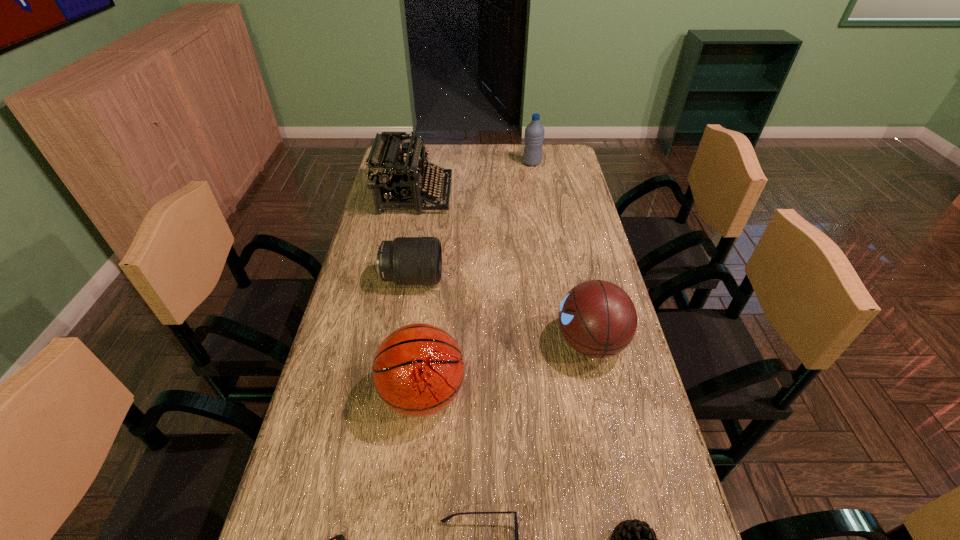
You are a GUI agent. You are given a task and a screenshot of the screen. Output one action in this format:
    pyautogui.click(x=<x>, y=<y>)
    Task: Click on the typewriter
    
    Given the screenshot: What is the action you would take?
    pyautogui.click(x=394, y=180)

You are a GUI agent. You are given a task and a screenshot of the screen. Output one action in this format:
    pyautogui.click(x=<x>, y=<y>)
    Task: Click on the farthest object
    This screenshot has height=540, width=960.
    Given the screenshot: What is the action you would take?
    pyautogui.click(x=534, y=133)

In order to click on the left basketball in this screenshot , I will do `click(418, 370)`.

The width and height of the screenshot is (960, 540). What are the coordinates of `the right basketball` in the screenshot? It's located at (597, 318).

Where is `the third farthest object`? This screenshot has width=960, height=540. the third farthest object is located at coordinates (406, 260).

Locate an element on the screen. Image resolution: width=960 pixels, height=540 pixels. the fourth shortest object is located at coordinates (406, 260).

What are the coordinates of `blank area located 0.060m on the typing side of the typewriter` in the screenshot? It's located at click(468, 195).

Where is `vacant space situated 0.060m on the left of the water bottle`? The image size is (960, 540). vacant space situated 0.060m on the left of the water bottle is located at coordinates (508, 163).

Locate an element on the screen. The width and height of the screenshot is (960, 540). free space located 0.260m on the side with spill of the left basketball is located at coordinates (577, 394).

Where is `vacant region located 0.090m on the front of the right basketball`? Image resolution: width=960 pixels, height=540 pixels. vacant region located 0.090m on the front of the right basketball is located at coordinates (606, 407).